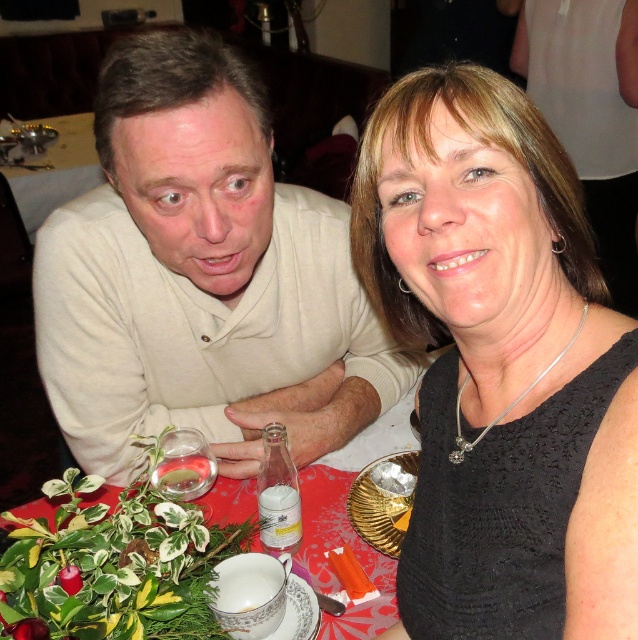
You are a waiter at a restaurant and need to serve a customer. You see the white matte shirt at left and the clear glass water at left. Which item is closer to the floor?

The white matte shirt at left is positioned under clear glass water at left, so the white matte shirt at left is closer to the floor.

You are a photographer trying to capture a candid shot of the white matte shirt at left and the clear glass water at left. Which object should you focus on first if you want to ensure both are in frame without moving the camera?

The white matte shirt at left is not as tall as the clear glass water at left, so you should focus on the clear glass water at left first to ensure both are in frame without moving the camera.